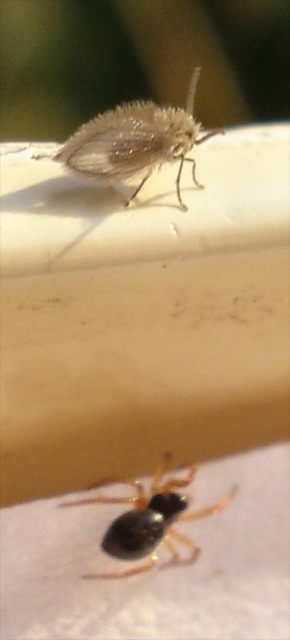
You are an entomologist observing two insects on a smooth surface. You notice the translucent fuzzy fly at upper center and the black glossy spider at lower center. Which insect is smaller in size?

The translucent fuzzy fly at upper center is smaller compared to the black glossy spider at lower center.